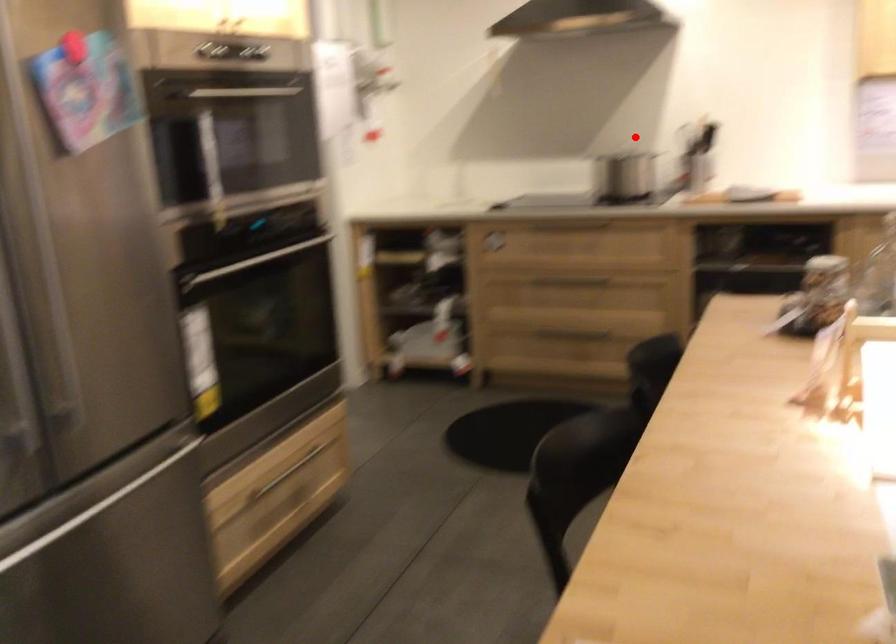
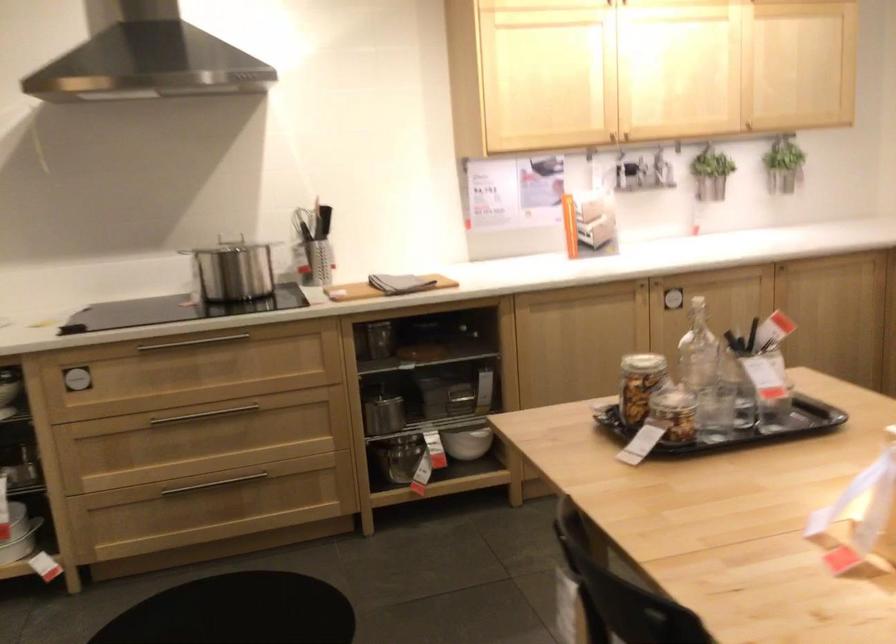
In the second image, find the point that corresponds to the highlighted location in the first image.

(229, 236)